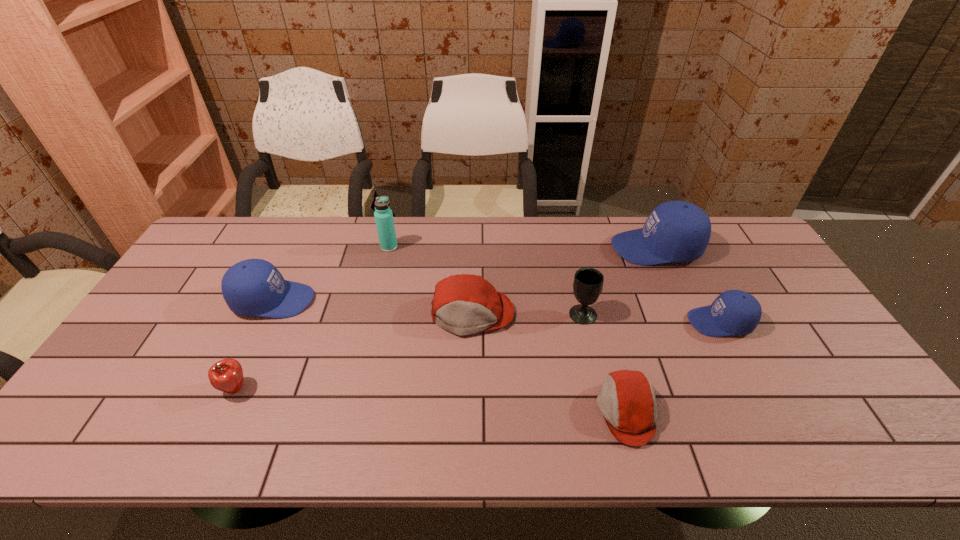
You are a GUI agent. You are given a task and a screenshot of the screen. Output one action in this format:
    pyautogui.click(x=<x>, y=<y>)
    Task: Click on the free point at the far edge
    Image resolution: width=960 pixels, height=540 pixels.
    Given the screenshot: What is the action you would take?
    pyautogui.click(x=355, y=238)

I want to click on vacant space at the near edge of the desktop, so click(408, 453).

Image resolution: width=960 pixels, height=540 pixels. Find the location of `free location at the left edge`. free location at the left edge is located at coordinates (105, 388).

In the image, there is a desktop. What are the coordinates of `vacant space at the right edge` in the screenshot? It's located at (778, 300).

The height and width of the screenshot is (540, 960). Find the location of `vacant area at the far left corner of the desktop`. vacant area at the far left corner of the desktop is located at coordinates (210, 252).

In order to click on free location at the far right corner of the desktop in this screenshot , I will do `click(756, 247)`.

I want to click on vacant region between the fourth object from left to right and the chalice, so click(x=527, y=314).

You are a GUI agent. You are given a task and a screenshot of the screen. Output one action in this format:
    pyautogui.click(x=<x>, y=<y>)
    Task: Click on the blank region between the farthest blue cap and the left red cap
    
    Given the screenshot: What is the action you would take?
    pyautogui.click(x=564, y=281)

This screenshot has width=960, height=540. Identify the location of free spot between the chalice and the fourth object from left to right. (527, 314).

This screenshot has width=960, height=540. I want to click on empty space that is in between the farthest blue cap and the third object from left to right, so click(x=522, y=247).